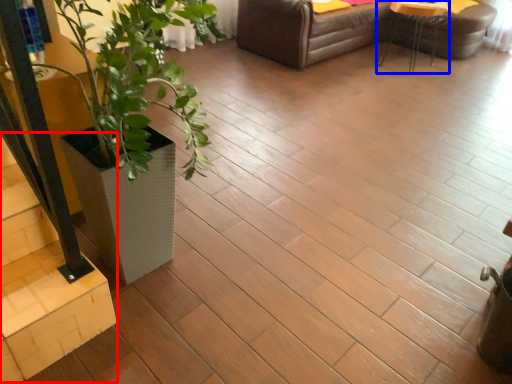
Question: Which object is closer to the camera taking this photo, stairwell (highlighted by a red box) or table (highlighted by a blue box)?

Choices:
 (A) stairwell
 (B) table

Answer: (A)